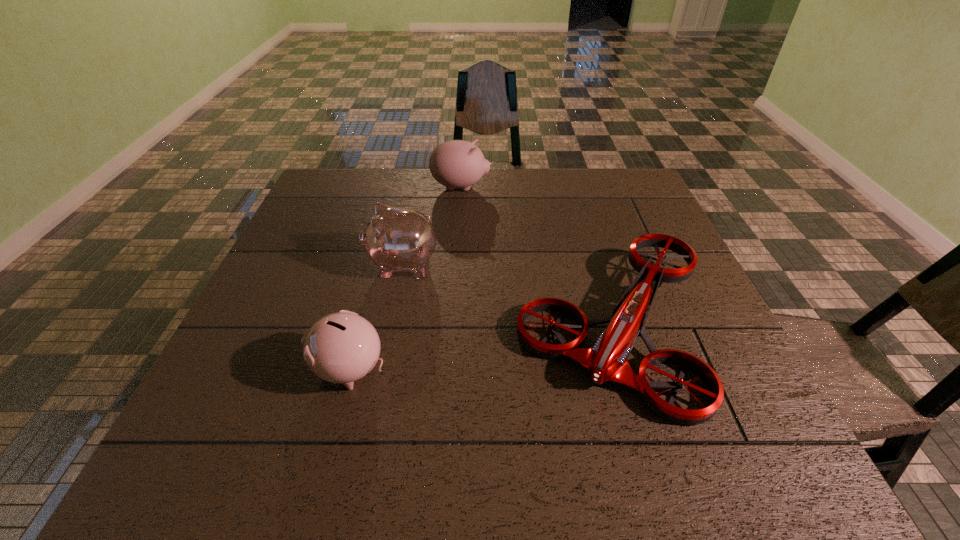
Image resolution: width=960 pixels, height=540 pixels. I want to click on free space between the farthest object and the rightmost object, so click(x=537, y=257).

Locate an element on the screen. This screenshot has width=960, height=540. free space that is in between the shortest object and the farthest object is located at coordinates (537, 257).

You are a GUI agent. You are given a task and a screenshot of the screen. Output one action in this format:
    pyautogui.click(x=<x>, y=<y>)
    Task: Click on the free space between the shortest object and the farthest piggy bank
    
    Given the screenshot: What is the action you would take?
    pyautogui.click(x=537, y=257)

You are a GUI agent. You are given a task and a screenshot of the screen. Output one action in this format:
    pyautogui.click(x=<x>, y=<y>)
    Task: Click on the vacant space that is in between the shortest object and the second farthest piggy bank
    
    Given the screenshot: What is the action you would take?
    pyautogui.click(x=508, y=296)

Locate an element on the screen. The width and height of the screenshot is (960, 540). vacant area that lies between the nearest piggy bank and the farthest piggy bank is located at coordinates (405, 278).

In order to click on empty space between the drone and the nearest piggy bank in this screenshot , I will do `click(482, 348)`.

Locate an element on the screen. object that stands as the closest to the rightmost object is located at coordinates [396, 239].

Locate an element on the screen. object that is the third nearest to the drone is located at coordinates (457, 163).

Point out which piggy bank is positioned as the third nearest to the shortest object. Please provide its 2D coordinates. Your answer should be formatted as a tuple, i.e. [(x, y)], where the tuple contains the x and y coordinates of a point satisfying the conditions above.

[(457, 163)]

At what (x,y) coordinates should I click in order to perform the action: click on the closest piggy bank to the nearest piggy bank. Please return your answer as a coordinate pair (x, y). The height and width of the screenshot is (540, 960). Looking at the image, I should click on (396, 239).